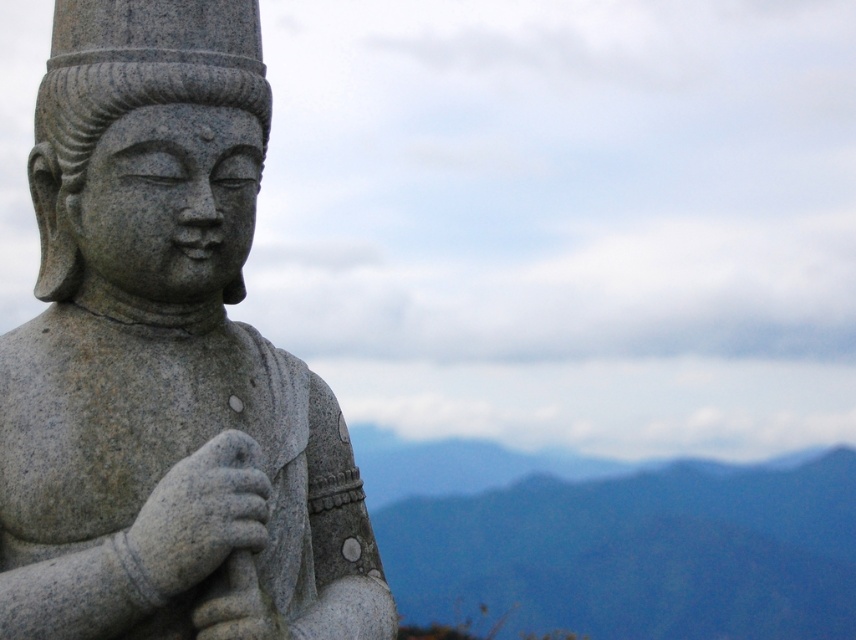
Does granite statue at left have a larger size compared to blue-green textured mountain at lower right?

Incorrect, granite statue at left is not larger than blue-green textured mountain at lower right.

Does point (164, 332) come closer to viewer compared to point (724, 611)?

Yes, point (164, 332) is in front of point (724, 611).

Does point (242, 291) come farther from viewer compared to point (765, 566)?

No, it is in front of (765, 566).

The width and height of the screenshot is (856, 640). In order to click on granite statue at left in this screenshot , I will do coord(165,360).